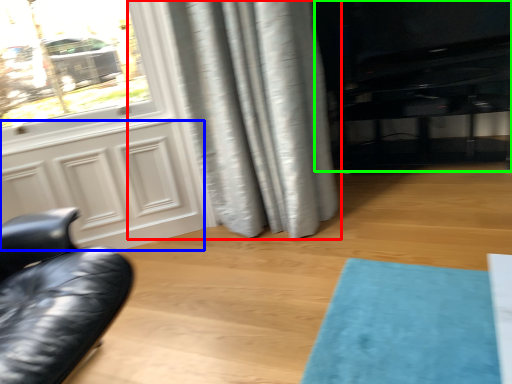
Question: Which object is the closest to the curtain (highlighted by a red box)? Choose among these: screen door (highlighted by a blue box) or entertainment center (highlighted by a green box).

Choices:
 (A) screen door
 (B) entertainment center

Answer: (A)